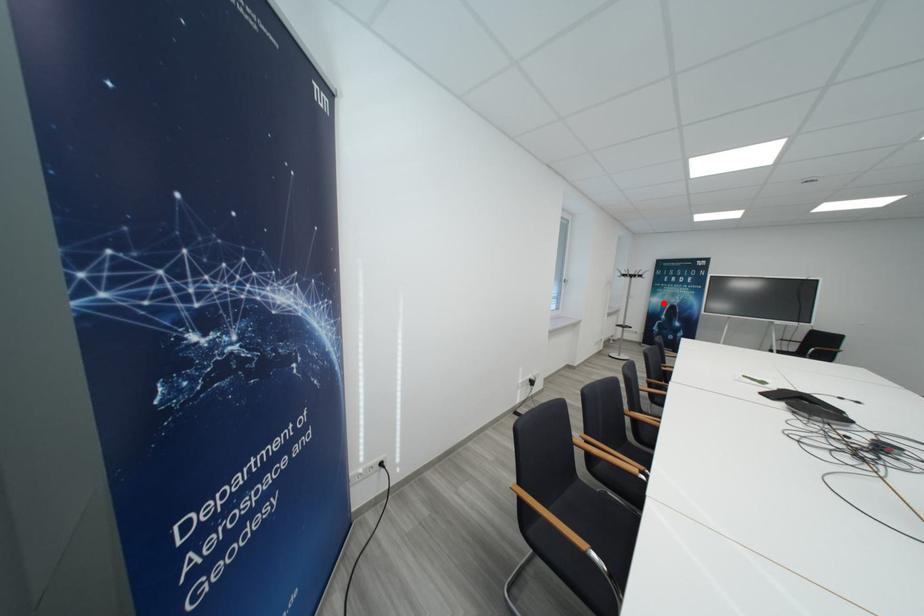
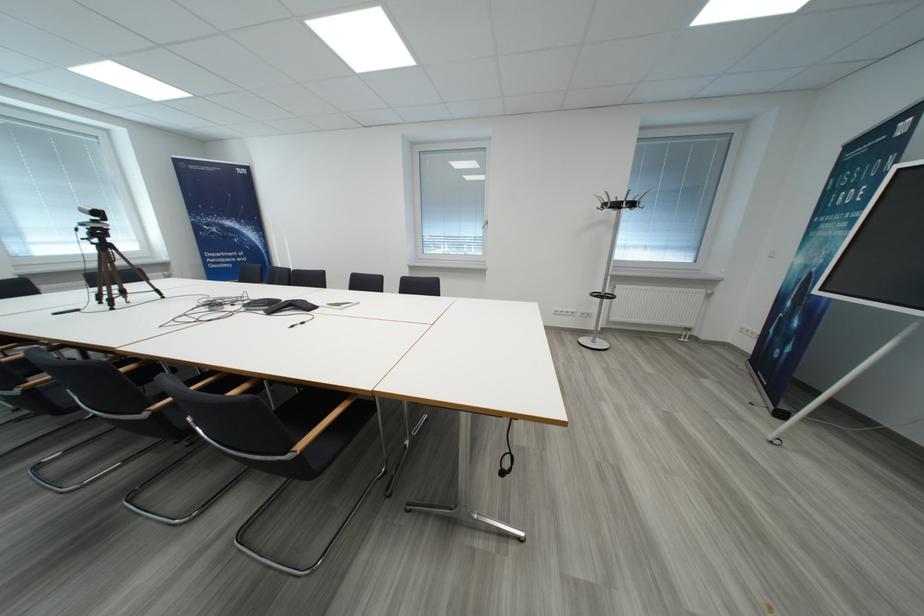
In the second image, find the point that corresponds to the highlighted location in the first image.

(807, 264)